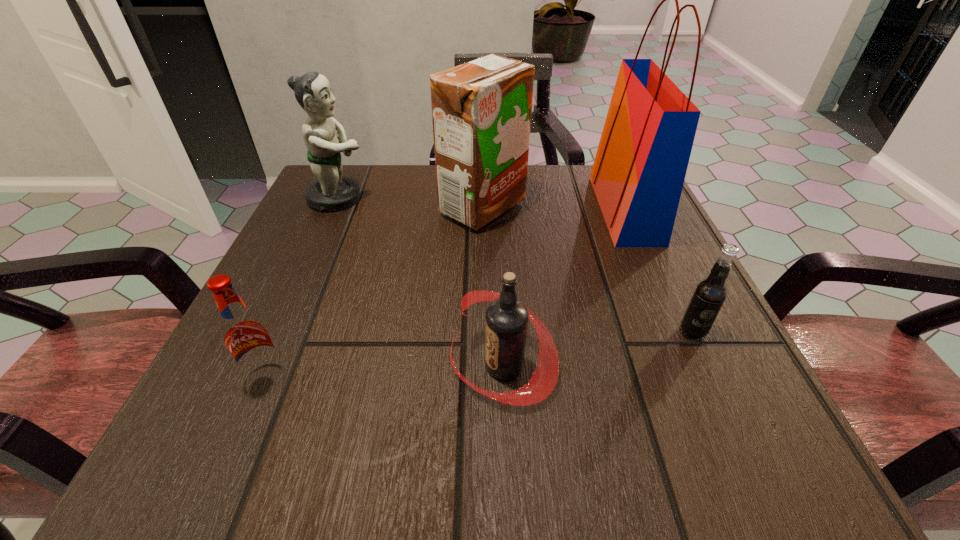
Identify the location of free space between the second root beer from left to right and the leftmost root beer. (385, 371).

Find the location of `empty space that is in between the second root beer from right to left and the leftmost root beer`. empty space that is in between the second root beer from right to left and the leftmost root beer is located at coordinates (385, 371).

Where is `unoccupied position between the leftmost root beer and the rightmost root beer`? unoccupied position between the leftmost root beer and the rightmost root beer is located at coordinates (480, 354).

Identify the location of free space between the carton and the figurine. This screenshot has height=540, width=960. click(411, 203).

Find the location of a particular element. This screenshot has width=960, height=540. free space that is in between the leftmost root beer and the figurine is located at coordinates (302, 287).

Select which object is the closest to the leftmost root beer. Please provide its 2D coordinates. Your answer should be formatted as a tuple, i.e. [(x, y)], where the tuple contains the x and y coordinates of a point satisfying the conditions above.

[(507, 318)]

Locate an element on the screen. The height and width of the screenshot is (540, 960). object that ranks as the closest to the leftmost root beer is located at coordinates (507, 318).

Locate an element on the screen. The height and width of the screenshot is (540, 960). the third closest root beer to the carton is located at coordinates (245, 334).

Identify which root beer is the closest to the rightmost root beer. Please provide its 2D coordinates. Your answer should be formatted as a tuple, i.e. [(x, y)], where the tuple contains the x and y coordinates of a point satisfying the conditions above.

[(507, 318)]

At what (x,y) coordinates should I click in order to perform the action: click on free spot that satisfies the following two spatial constraints: 1. on the label of the rightmost root beer; 2. on the label of the second root beer from left to right. Please return your answer as a coordinate pair (x, y). This screenshot has height=540, width=960. Looking at the image, I should click on (708, 366).